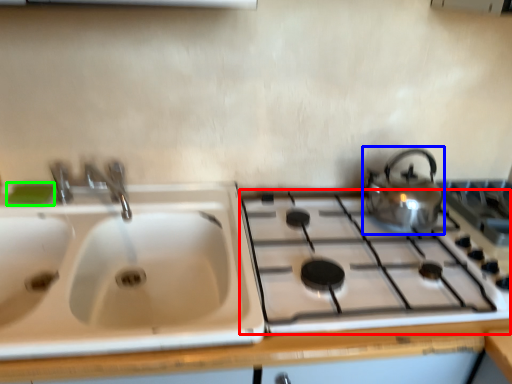
Question: Based on their relative distances, which object is nearer to gas stove (highlighted by a red box)? Choose from kettle (highlighted by a blue box) and soap (highlighted by a green box).

Choices:
 (A) kettle
 (B) soap

Answer: (A)